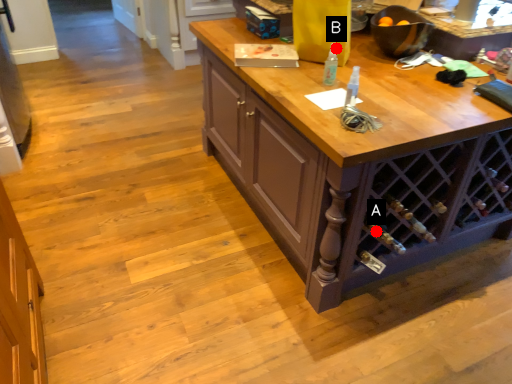
Question: Two points are circled on the image, labeled by A and B beside each circle. Which point is further to the camera?

Choices:
 (A) A is further
 (B) B is further

Answer: (B)